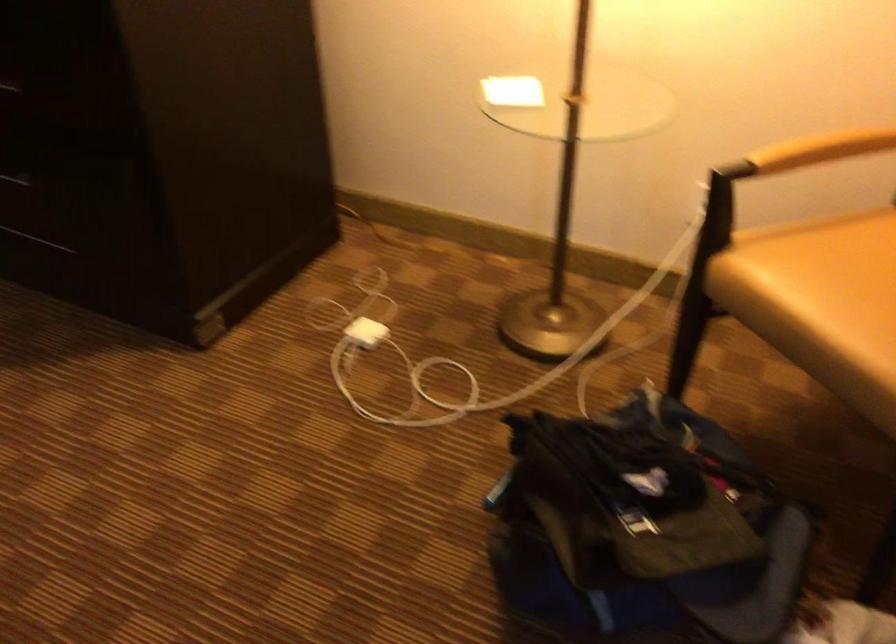
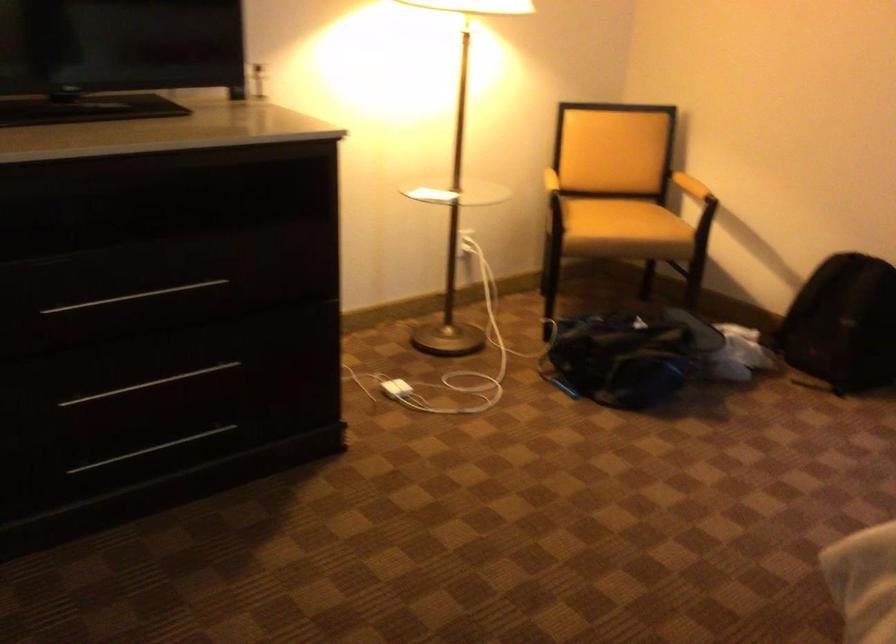
The point at (554, 507) is marked in the first image. Where is the corresponding point in the second image?

(627, 355)